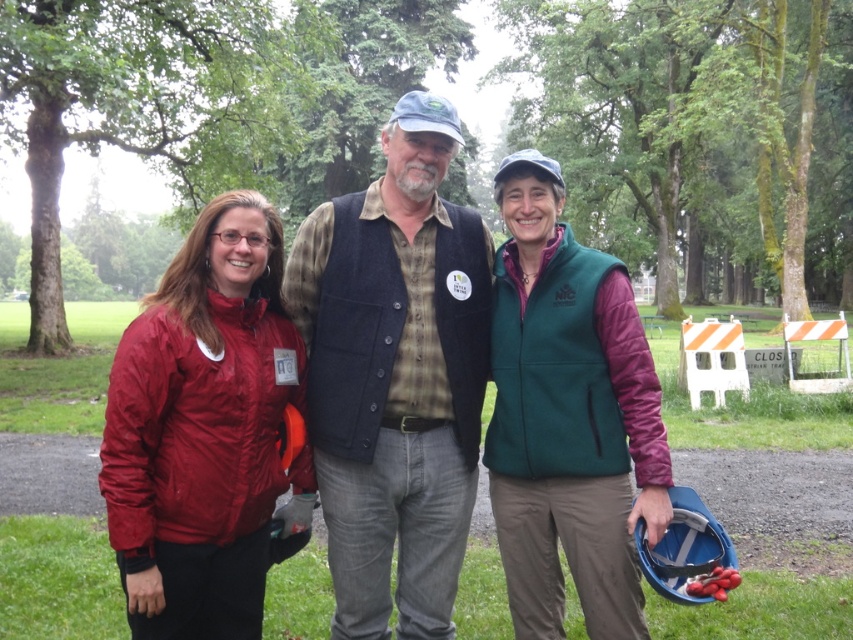
You are a photographer positioned behind the matte red jacket at left and the green fleece vest at center. Which person should you focus on first to ensure they are in the foreground of your photo?

You should focus on the matte red jacket at left first because it is closer to the viewer than the green fleece vest at center, making it the foreground subject.

You are a photographer trying to capture a photo of the green fleece vest at center without including the matte red jacket at left in the frame. Is this possible given their positions?

The matte red jacket at left is above the green fleece vest at center, so if you position your camera to focus on the lower part where the green fleece vest at center is located, you can exclude the matte red jacket at left from the frame.

You are a photographer standing 10 feet away from the scene. You want to capture a photo that includes both the matte red jacket at left and the denim vest at center without any distortion. Given the distance between them, can you fit both subjects into your camera frame if your camera has a maximum field of view of 8 inches?

The distance between the matte red jacket at left and the denim vest at center is 5.61 inches. Since your camera has a maximum field of view of 8 inches, which is wider than the 5.61 inches separating them, you can fit both subjects into your camera frame without distortion.